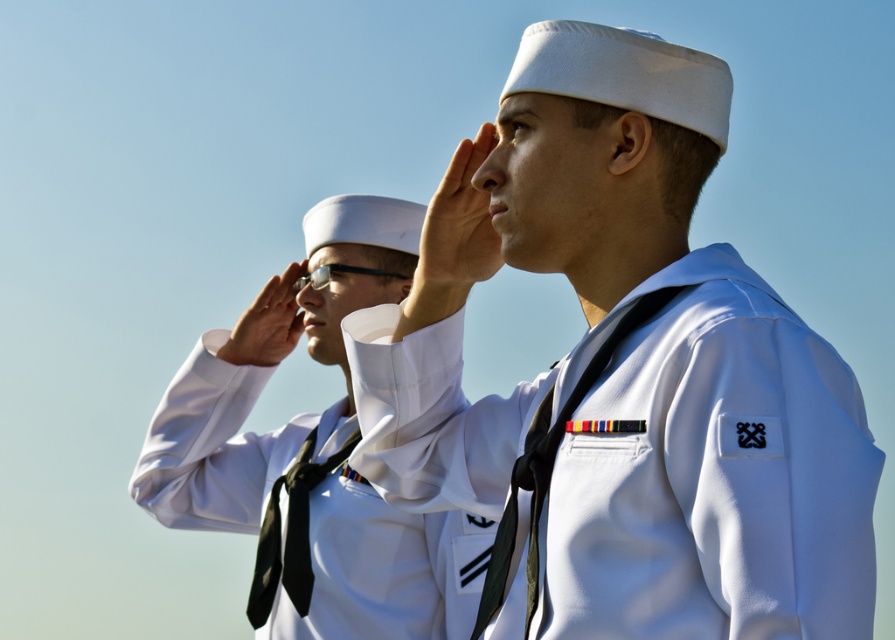
You are a photographer at a military ceremony. You need to position two subjects in the frame such that their uniforms are clearly visible. Given the white matte uniform at center and the white matte sailor uniform at center, which one should you adjust to the left to avoid overlapping?

The white matte uniform at center is already positioned to the right of the white matte sailor uniform at center. To avoid overlapping, you should adjust the white matte uniform at center further to the right or move the white matte sailor uniform at center further to the left.

You are a photographer at a military event. You need to capture a photo where both the white matte uniform at center and the white matte sailor uniform at center are visible. Given that your camera frame can only accommodate objects up to the width of the wider uniform, will both uniforms fit in the frame?

The white matte sailor uniform at center is wider than the white matte uniform at center. Since the camera frame can accommodate up to the width of the wider uniform, both uniforms will fit in the frame as the frame can hold the wider one, which is the white matte sailor uniform at center.